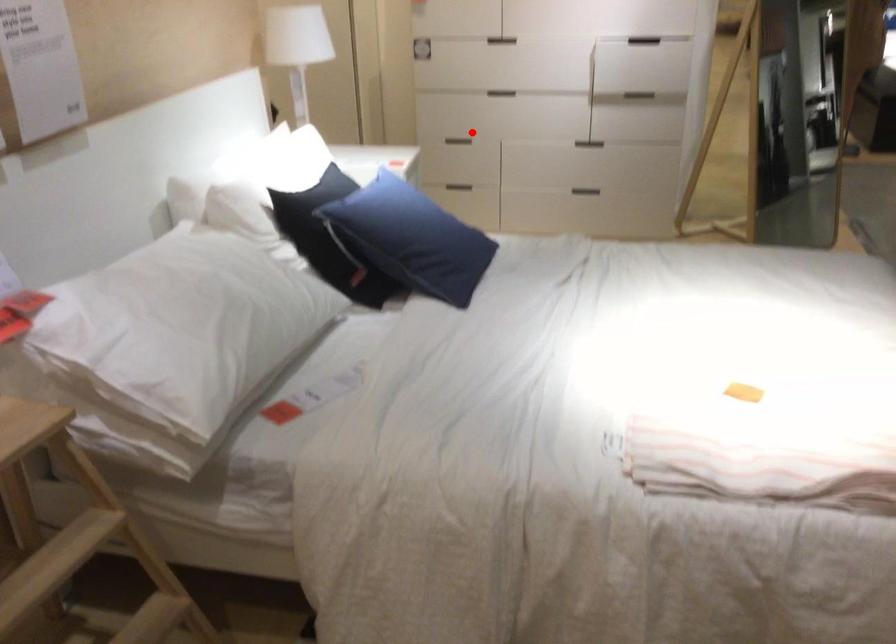
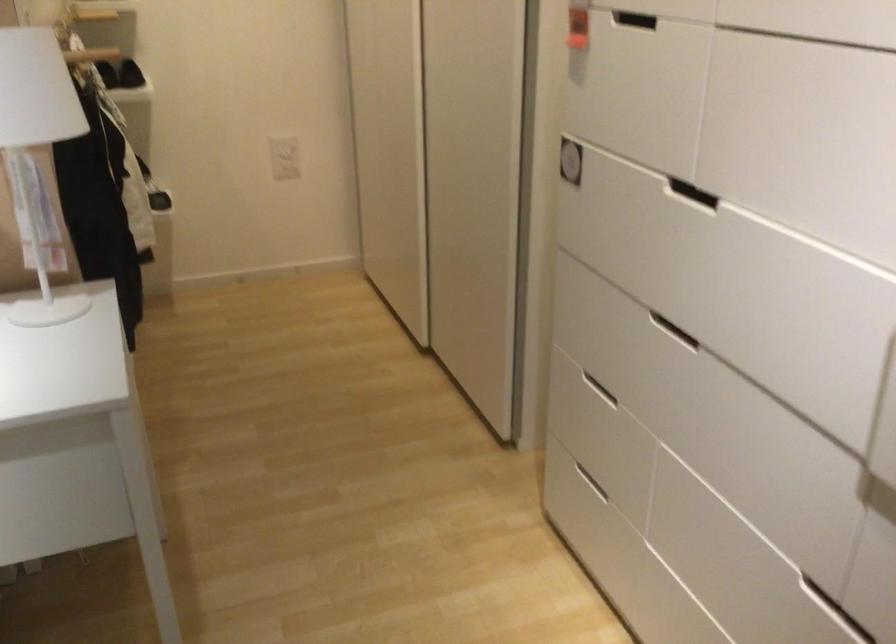
Where in the second image is the point corresponding to the highlighted location from the first image?

(586, 379)